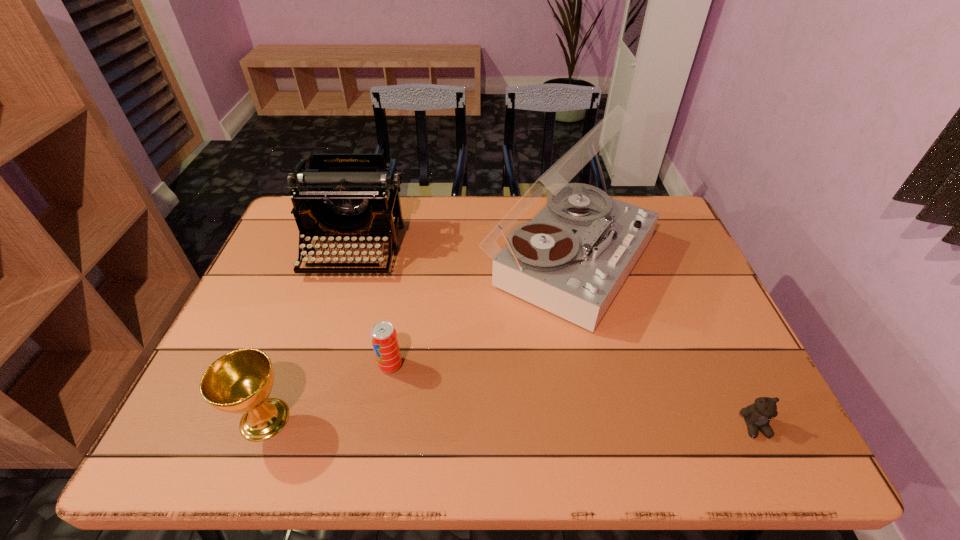
You are a GUI agent. You are given a task and a screenshot of the screen. Output one action in this format:
    pyautogui.click(x=<x>, y=<y>)
    Task: Click on the vacant area that lies between the shortest object and the third farthest object
    
    Given the screenshot: What is the action you would take?
    click(x=572, y=396)

Identify the location of vacant area between the record player and the typewriter. This screenshot has width=960, height=540. (462, 255).

Locate an element on the screen. The height and width of the screenshot is (540, 960). free space between the fourth object from left to right and the typewriter is located at coordinates (462, 255).

Find the location of a particular element. This screenshot has height=540, width=960. free spot between the typewriter and the tallest object is located at coordinates (462, 255).

This screenshot has height=540, width=960. What are the coordinates of `empty location between the chalice and the soda can` in the screenshot? It's located at (327, 392).

You are a GUI agent. You are given a task and a screenshot of the screen. Output one action in this format:
    pyautogui.click(x=<x>, y=<y>)
    Task: Click on the free space between the second tallest object and the teddy bear
    
    Given the screenshot: What is the action you would take?
    pyautogui.click(x=555, y=338)

Where is `empty location between the second tallest object and the soda can`? empty location between the second tallest object and the soda can is located at coordinates (372, 307).

Identify the location of vacant space that is in between the tallest object and the teddy bear. This screenshot has height=540, width=960. (661, 343).

Locate an element on the screen. free space between the soda can and the chalice is located at coordinates (327, 392).

Locate which object is the fourth closest to the chalice. Please provide its 2D coordinates. Your answer should be formatted as a tuple, i.e. [(x, y)], where the tuple contains the x and y coordinates of a point satisfying the conditions above.

[(757, 416)]